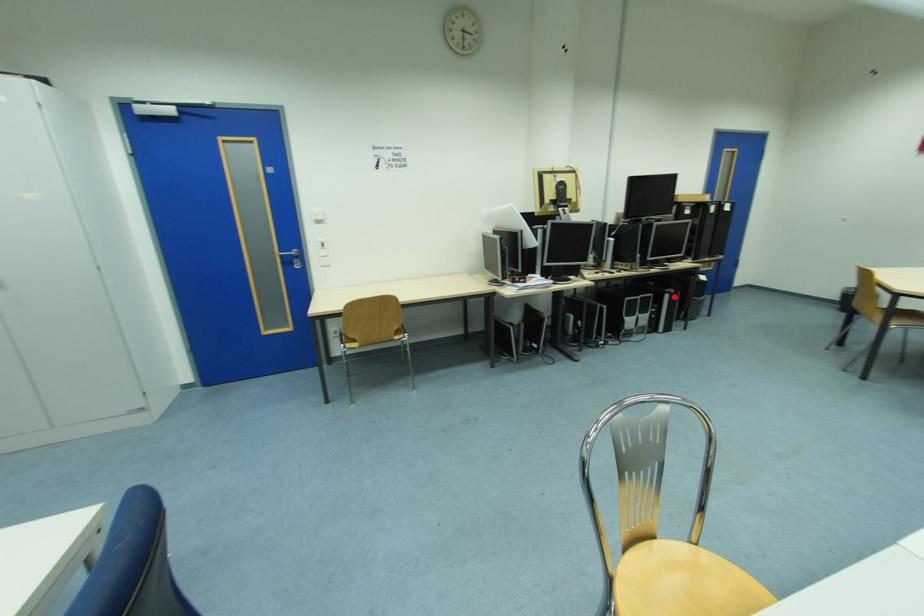
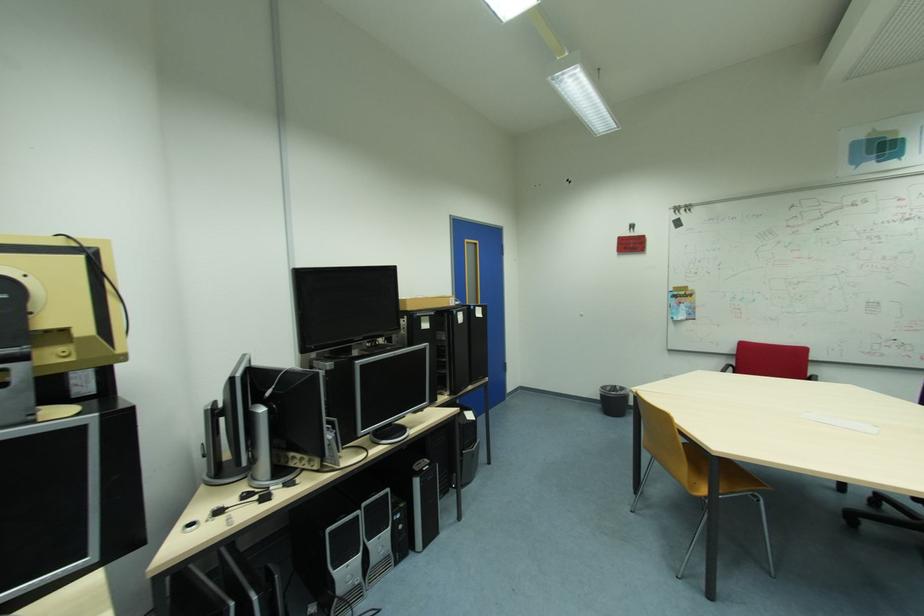
In the second image, find the point that corresponds to the highlighted location in the first image.

(424, 482)